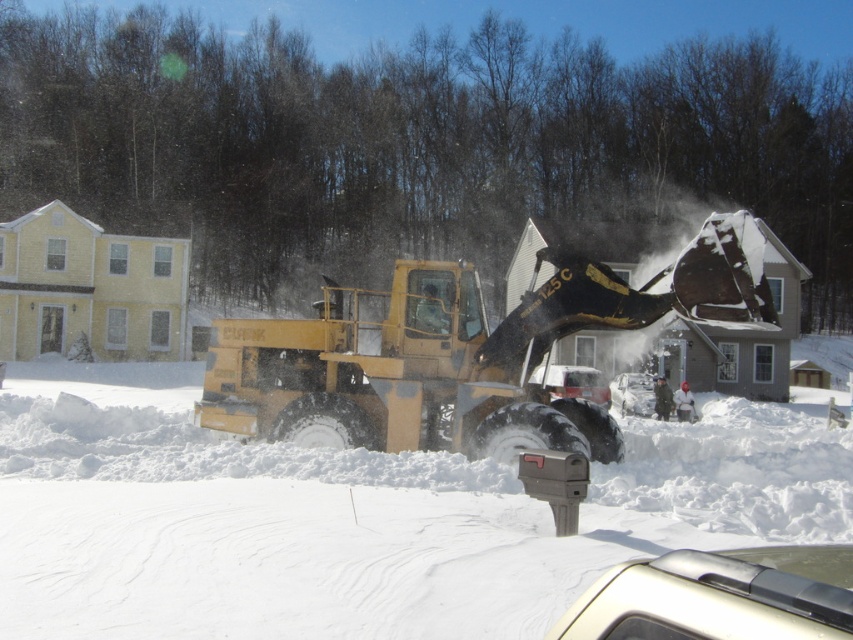
Question: Estimate the real-world distances between objects in this image. Which object is closer to the yellow rubber plow at center?

Choices:
 (A) white matte car at center
 (B) white fluffy snow at center

Answer: (B)

Question: Is metallic silver car at center behind white matte car at center?

Choices:
 (A) yes
 (B) no

Answer: (B)

Question: In this image, where is metallic silver car at center located relative to white matte car at center?

Choices:
 (A) left
 (B) right

Answer: (A)

Question: Can you confirm if yellow rubber plow at center is positioned above metallic silver car at lower right?

Choices:
 (A) no
 (B) yes

Answer: (B)

Question: Which of the following is the farthest from the observer?

Choices:
 (A) metallic silver car at center
 (B) metallic silver car at lower right

Answer: (A)

Question: Which is farther from the white fluffy snow at center?

Choices:
 (A) metallic silver car at lower right
 (B) yellow rubber plow at center
 (C) metallic silver car at center

Answer: (A)